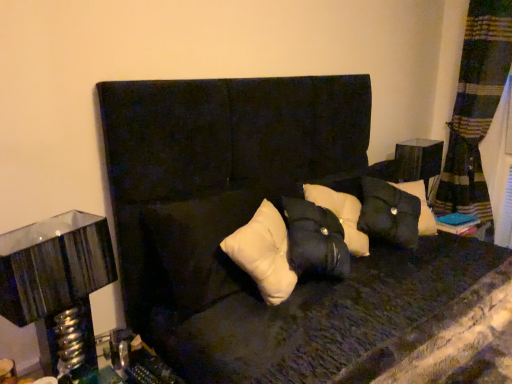
Question: Should I look upward or downward to see metallic silver table lamp at left?

Choices:
 (A) down
 (B) up

Answer: (A)

Question: Can you confirm if matte black side table at right is taller than velvet black couch at center?

Choices:
 (A) no
 (B) yes

Answer: (A)

Question: Is matte black side table at right looking in the opposite direction of velvet black couch at center?

Choices:
 (A) yes
 (B) no

Answer: (B)

Question: Does matte black side table at right turn towards velvet black couch at center?

Choices:
 (A) yes
 (B) no

Answer: (B)

Question: Is velvet black couch at center surrounded by matte black side table at right?

Choices:
 (A) no
 (B) yes

Answer: (A)

Question: Does matte black side table at right have a greater width compared to velvet black couch at center?

Choices:
 (A) yes
 (B) no

Answer: (B)

Question: From a real-world perspective, is matte black side table at right on velvet black couch at center?

Choices:
 (A) yes
 (B) no

Answer: (A)

Question: Is matte black side table at right at the left side of white matte pillow at center?

Choices:
 (A) yes
 (B) no

Answer: (B)

Question: Is matte black side table at right far from white matte pillow at center?

Choices:
 (A) yes
 (B) no

Answer: (A)

Question: Can you confirm if matte black side table at right is shorter than white matte pillow at center?

Choices:
 (A) no
 (B) yes

Answer: (A)

Question: Could you tell me if matte black side table at right is facing white matte pillow at center?

Choices:
 (A) yes
 (B) no

Answer: (B)

Question: Is matte black side table at right turned away from white matte pillow at center?

Choices:
 (A) no
 (B) yes

Answer: (A)

Question: Considering the relative sizes of matte black side table at right and white matte pillow at center in the image provided, is matte black side table at right wider than white matte pillow at center?

Choices:
 (A) no
 (B) yes

Answer: (A)

Question: Considering the relative positions of metallic silver table lamp at left and matte black side table at right in the image provided, is metallic silver table lamp at left behind matte black side table at right?

Choices:
 (A) no
 (B) yes

Answer: (A)